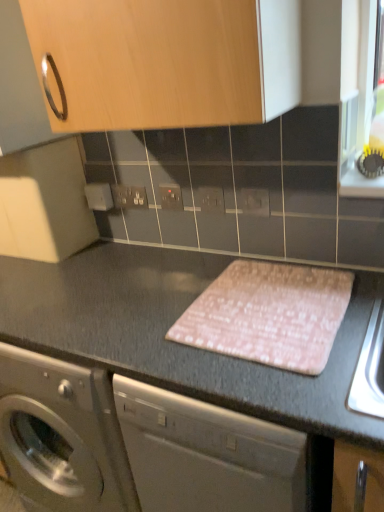
Question: Does white plastic electrical outlet at center, which is the first electric outlet from left to right, have a lesser width compared to white plastic electric outlet at center, marked as the 2th electric outlet in a right-to-left arrangement?

Choices:
 (A) no
 (B) yes

Answer: (A)

Question: Is white plastic electrical outlet at center, which is counted as the first electric outlet, starting from the back, positioned in front of white plastic electric outlet at center, which ranks as the 3th electric outlet in left-to-right order?

Choices:
 (A) yes
 (B) no

Answer: (B)

Question: Would you say white plastic electrical outlet at center, arranged as the 4th electric outlet when viewed from the front, is outside white plastic electric outlet at center, which ranks as the second electric outlet in front-to-back order?

Choices:
 (A) yes
 (B) no

Answer: (A)

Question: Does white plastic electrical outlet at center, which is the first electric outlet from left to right, have a smaller size compared to white plastic electric outlet at center, which ranks as the second electric outlet in front-to-back order?

Choices:
 (A) no
 (B) yes

Answer: (A)

Question: From the image's perspective, would you say white plastic electrical outlet at center, arranged as the 4th electric outlet when viewed from the front, is positioned over white plastic electric outlet at center, the third electric outlet viewed from the back?

Choices:
 (A) no
 (B) yes

Answer: (B)

Question: Is white plastic electrical outlet at center, arranged as the 4th electric outlet when viewed from the front, positioned far away from white plastic electric outlet at center, which ranks as the 3th electric outlet in left-to-right order?

Choices:
 (A) yes
 (B) no

Answer: (B)

Question: Is wooden cabinet at upper center thinner than matte gray electric outlet at center, arranged as the fourth electric outlet when viewed from the left?

Choices:
 (A) yes
 (B) no

Answer: (B)

Question: Considering the relative sizes of wooden cabinet at upper center and matte gray electric outlet at center, arranged as the first electric outlet when viewed from the right, in the image provided, is wooden cabinet at upper center smaller than matte gray electric outlet at center, arranged as the first electric outlet when viewed from the right,?

Choices:
 (A) yes
 (B) no

Answer: (B)

Question: Is wooden cabinet at upper center at the left side of matte gray electric outlet at center, marked as the first electric outlet in a front-to-back arrangement?

Choices:
 (A) yes
 (B) no

Answer: (A)

Question: Does wooden cabinet at upper center appear on the right side of matte gray electric outlet at center, arranged as the first electric outlet when viewed from the right?

Choices:
 (A) no
 (B) yes

Answer: (A)

Question: Considering the relative sizes of wooden cabinet at upper center and matte gray electric outlet at center, arranged as the first electric outlet when viewed from the right, in the image provided, is wooden cabinet at upper center wider than matte gray electric outlet at center, arranged as the first electric outlet when viewed from the right,?

Choices:
 (A) no
 (B) yes

Answer: (B)

Question: Does wooden cabinet at upper center lie behind matte gray electric outlet at center, arranged as the fourth electric outlet when viewed from the left?

Choices:
 (A) no
 (B) yes

Answer: (A)

Question: Considering the relative sizes of white plastic electric outlet at center, which ranks as the 3th electric outlet in left-to-right order, and matte gray electric outlet at center, arranged as the first electric outlet when viewed from the right, in the image provided, is white plastic electric outlet at center, which ranks as the 3th electric outlet in left-to-right order, smaller than matte gray electric outlet at center, arranged as the first electric outlet when viewed from the right,?

Choices:
 (A) yes
 (B) no

Answer: (A)